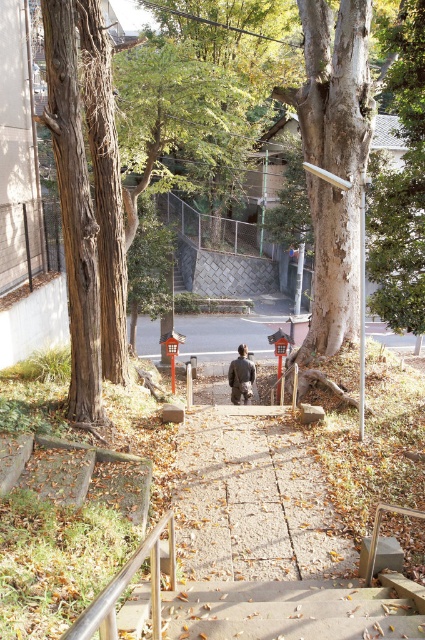
Which is above, concrete stairs at center or metallic silver railing at lower left?

metallic silver railing at lower left is higher up.

Which is in front, point (326, 632) or point (127, 582)?

Point (127, 582) is in front.

Identify the location of concrete stairs at center. The height and width of the screenshot is (640, 425). (291, 611).

Who is more distant from viewer, (101,593) or (243,387)?

The point (243,387) is behind.

Which is more to the right, metallic silver railing at lower left or camouflage jacket at center?

camouflage jacket at center

This screenshot has width=425, height=640. In order to click on metallic silver railing at lower left in this screenshot , I will do `click(125, 586)`.

Which is more to the left, concrete stairs at center or camouflage jacket at center?

camouflage jacket at center is more to the left.

Which is behind, point (121, 628) or point (246, 353)?

Point (246, 353)

Which is in front, point (243, 605) or point (234, 369)?

Point (243, 605) is in front.

You are a GUI agent. You are given a task and a screenshot of the screen. Output one action in this format:
    pyautogui.click(x=<x>, y=<y>)
    Task: Click on the concrete stairs at center
    This screenshot has height=640, width=425.
    Given the screenshot: What is the action you would take?
    pyautogui.click(x=291, y=611)